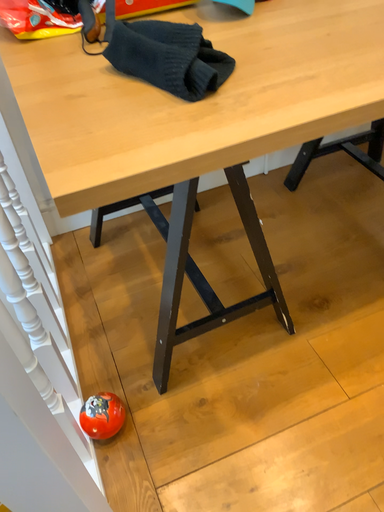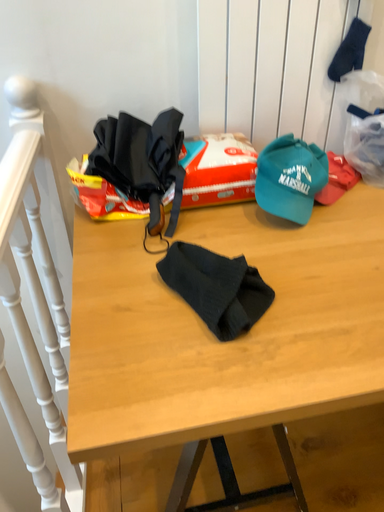
Question: Which way did the camera rotate in the video?

Choices:
 (A) rotated downward
 (B) rotated upward

Answer: (B)